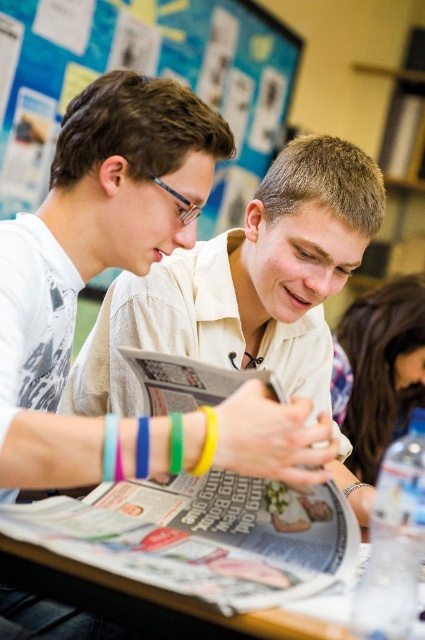
From the picture: You are an interior designer planning to hang a new poster in the room. The blue paperboard at upper center and the brown leather wallet at lower right are already present. Which object should you consider in terms of height when deciding where to place the new poster?

You should consider the blue paperboard at upper center because it is much taller than the brown leather wallet at lower right, so it will affect the vertical space available for hanging the new poster.

You are standing in the room and see the point at position (146, 74). What is the nearest object to that point?

The nearest object to the point at position (146, 74) is the blue paperboard at upper center.